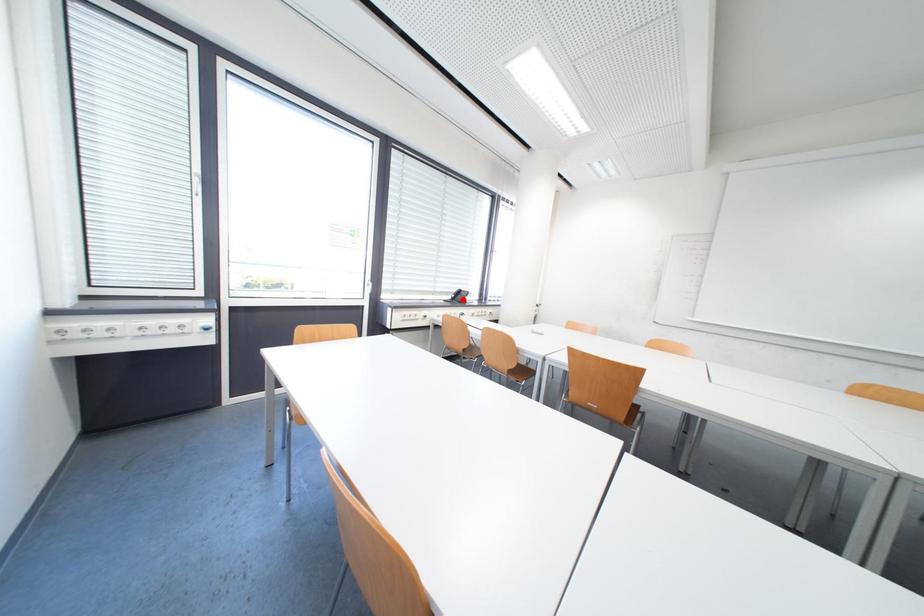
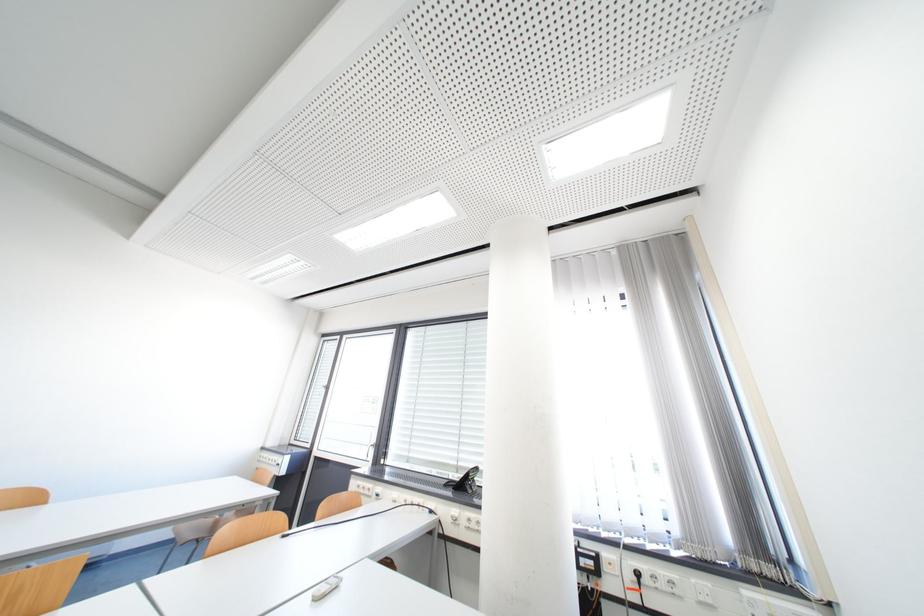
Question: I am providing you with two images of the same scene from different viewpoints. Image1 has a red point marked. In image2, the corresponding 3D location appears at what relative position? Reply with the corresponding letter.

Choices:
 (A) Closer
 (B) Farther

Answer: (B)